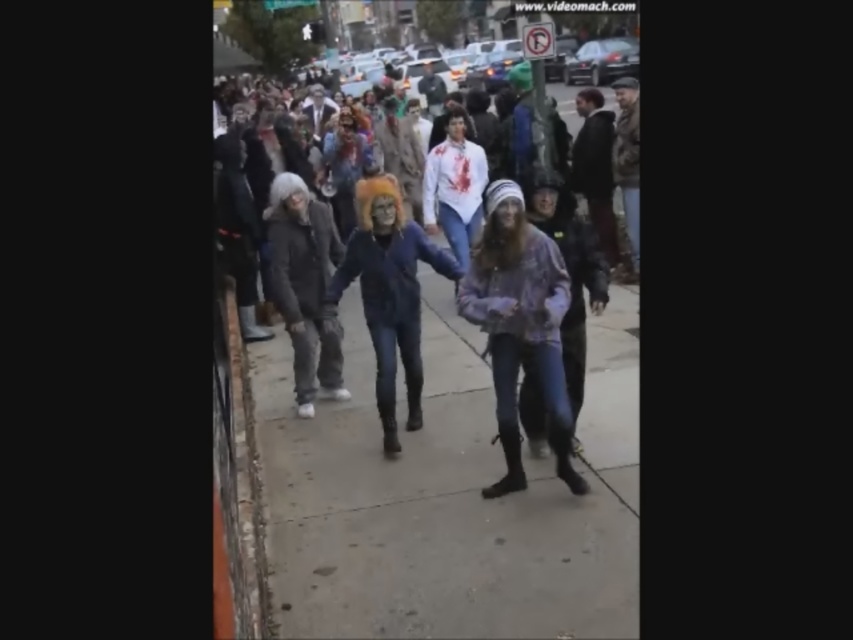
Question: Which point appears closest to the camera in this image?

Choices:
 (A) (483, 296)
 (B) (515, 552)
 (C) (357, 188)
 (D) (445, 392)

Answer: (B)

Question: Which object appears farthest from the camera in this image?

Choices:
 (A) denim jacket at center
 (B) orange fuzzy hat at center
 (C) concrete sidewalk at center
 (D) plaid fabric jacket at center

Answer: (B)

Question: Considering the relative positions of plaid fabric jacket at center and orange fuzzy hat at center in the image provided, where is plaid fabric jacket at center located with respect to orange fuzzy hat at center?

Choices:
 (A) left
 (B) right

Answer: (B)

Question: Estimate the real-world distances between objects in this image. Which object is farther from the denim jacket at center?

Choices:
 (A) plaid fabric jacket at center
 (B) orange fuzzy hat at center
 (C) concrete sidewalk at center

Answer: (B)

Question: In this image, where is plaid fabric jacket at center located relative to orange fuzzy hat at center?

Choices:
 (A) above
 (B) below

Answer: (B)

Question: Is denim jacket at center to the left of orange fuzzy hat at center from the viewer's perspective?

Choices:
 (A) no
 (B) yes

Answer: (A)